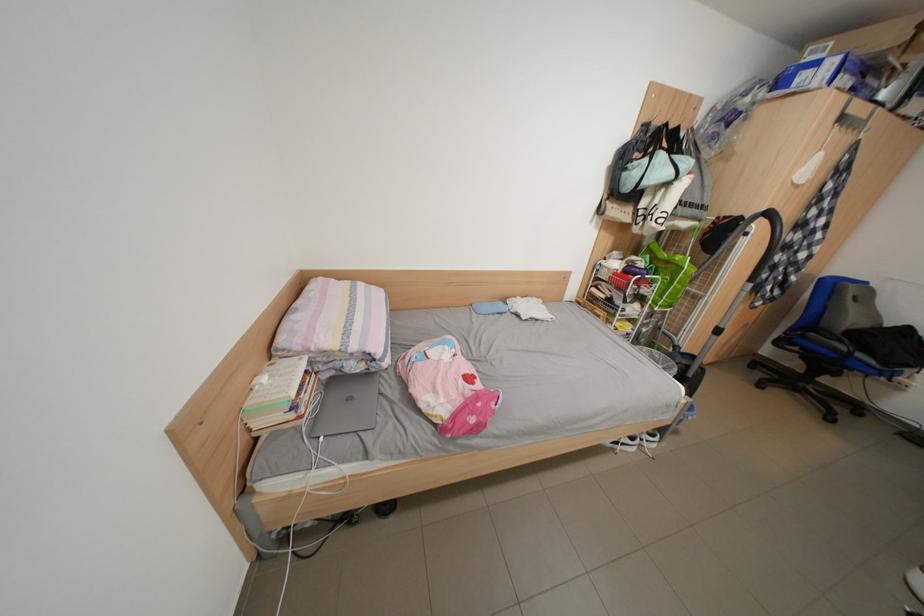
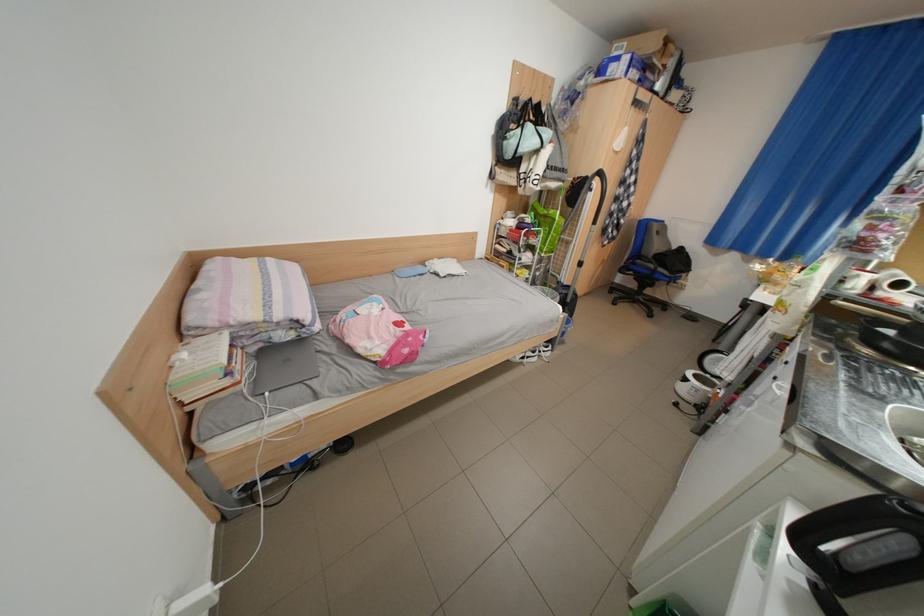
Find the pixel in the second image that matches point (685, 177) in the first image.

(552, 147)